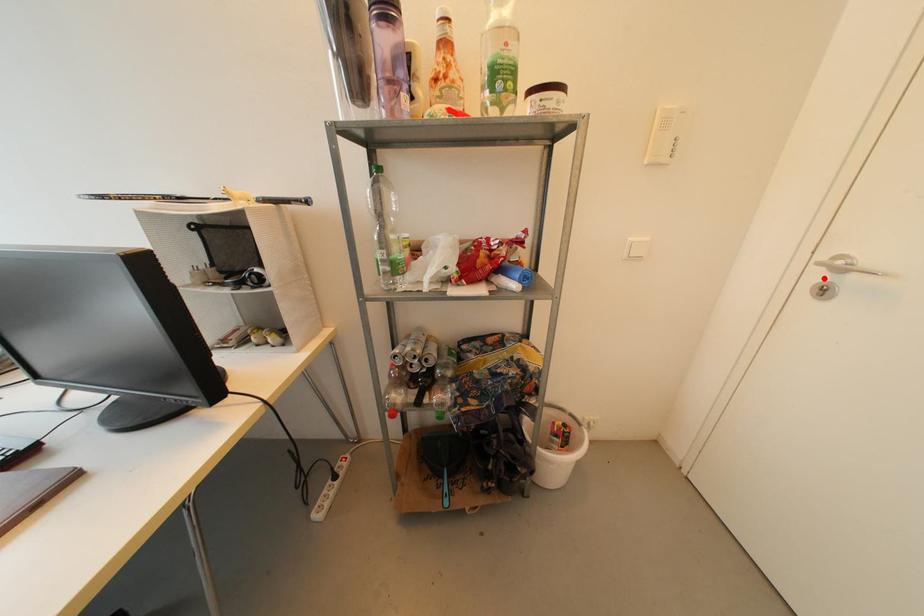
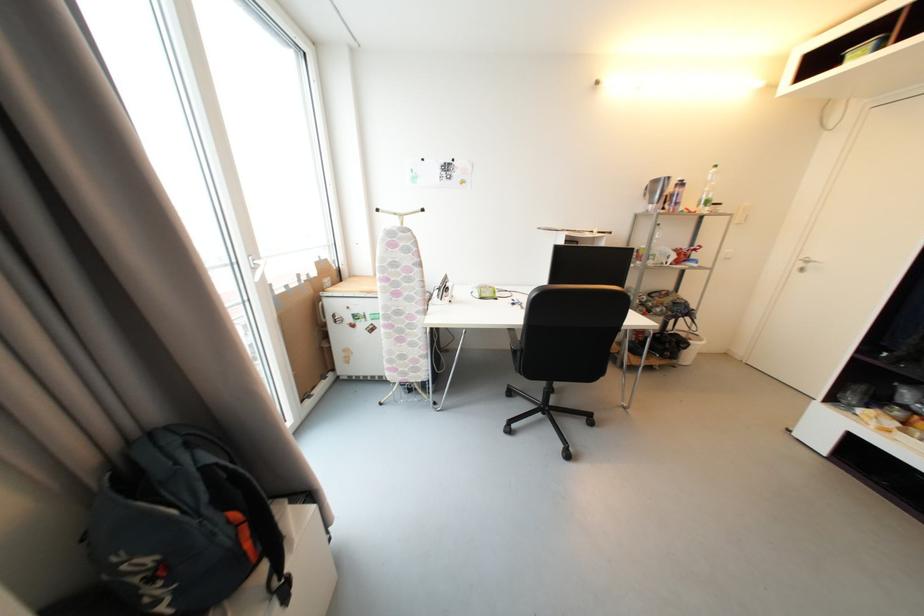
The point at the highlighted location is marked in the first image. Where is the corresponding point in the second image?

(806, 267)